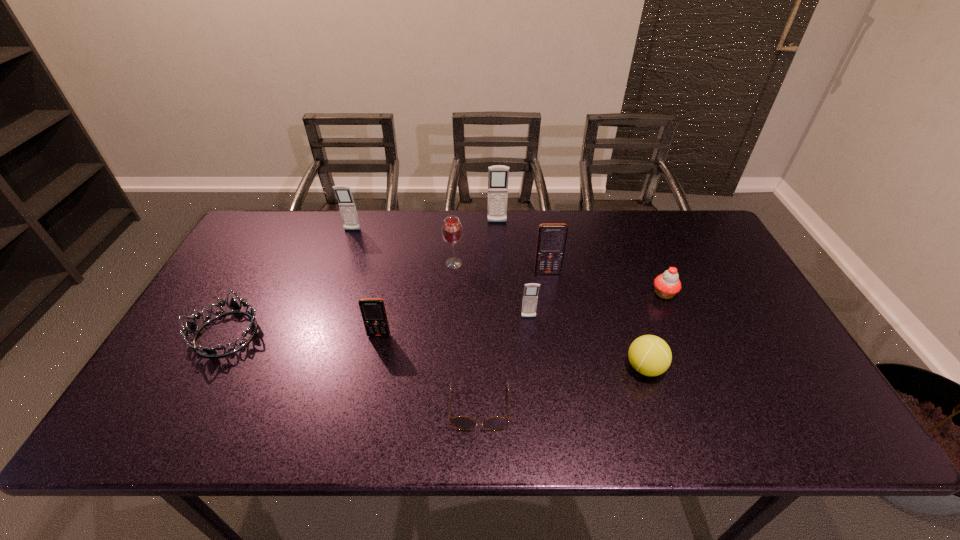
Identify the location of free space that is in between the third farthest cellular telephone and the smaller orange cellular telephone. (464, 304).

Locate an element on the screen. This screenshot has height=540, width=960. vacant region between the third nearest cellular telephone and the second cellular telephone from left to right is located at coordinates (464, 304).

You are a GUI agent. You are given a task and a screenshot of the screen. Output one action in this format:
    pyautogui.click(x=<x>, y=<y>)
    Task: Click on the vacant area that lies between the wineglass and the tennis ball
    
    Given the screenshot: What is the action you would take?
    pyautogui.click(x=549, y=315)

Where is `empty location between the right orange cellular telephone and the biggest gray cellular telephone`? This screenshot has height=540, width=960. empty location between the right orange cellular telephone and the biggest gray cellular telephone is located at coordinates (522, 248).

Locate an element on the screen. This screenshot has width=960, height=540. empty space that is in between the rightmost cellular telephone and the tiara is located at coordinates (387, 303).

This screenshot has height=540, width=960. Find the location of `vacant space that's between the green tennis ball and the nearest cellular telephone`. vacant space that's between the green tennis ball and the nearest cellular telephone is located at coordinates (512, 352).

Identify the location of the seventh closest object to the leftmost gray cellular telephone. (460, 422).

Select which object is the eighth closest to the shortest object. Please provide its 2D coordinates. Your answer should be formatted as a tuple, i.e. [(x, y)], where the tuple contains the x and y coordinates of a point satisfying the conditions above.

[(498, 175)]

Identify which cellular telephone is located as the second nearest to the green tennis ball. Please provide its 2D coordinates. Your answer should be formatted as a tuple, i.e. [(x, y)], where the tuple contains the x and y coordinates of a point satisfying the conditions above.

[(551, 240)]

Identify which cellular telephone is located as the second nearest to the farther orange cellular telephone. Please provide its 2D coordinates. Your answer should be formatted as a tuple, i.e. [(x, y)], where the tuple contains the x and y coordinates of a point satisfying the conditions above.

[(498, 175)]